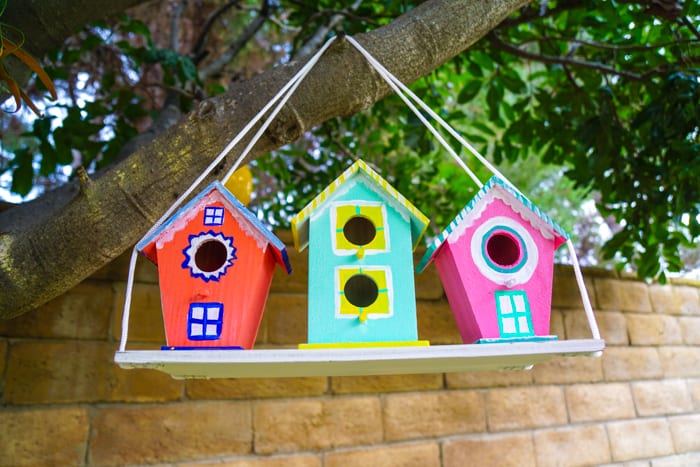
Find the location of a particular element. This screenshot has height=467, width=700. brick wall is located at coordinates coord(161,401), coord(631,432).